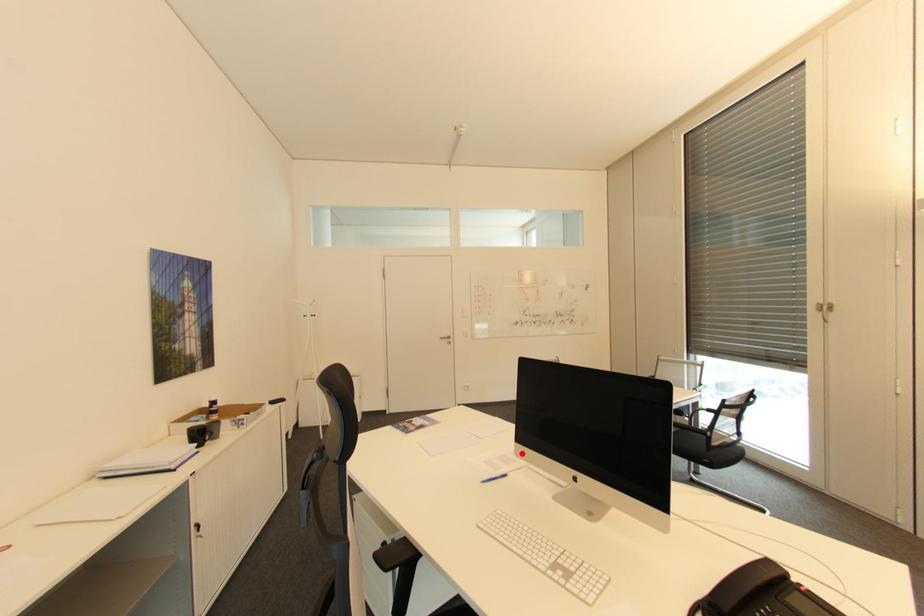
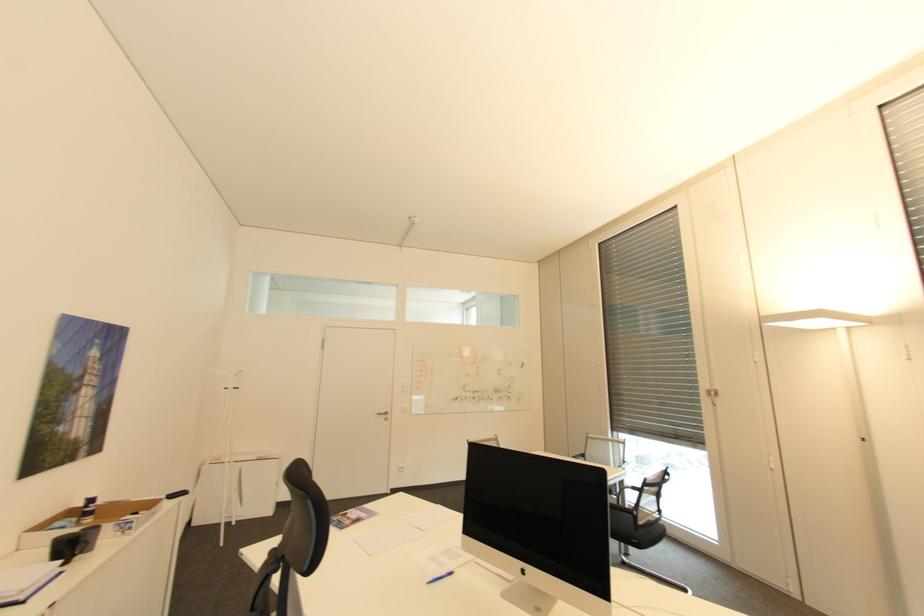
Question: A red point is marked in image1. In image2, is the corresponding 3D point closer to the camera or farther? Reply with the corresponding letter.

Choices:
 (A) The corresponding 3D point is closer.
 (B) The corresponding 3D point is farther.

Answer: (B)